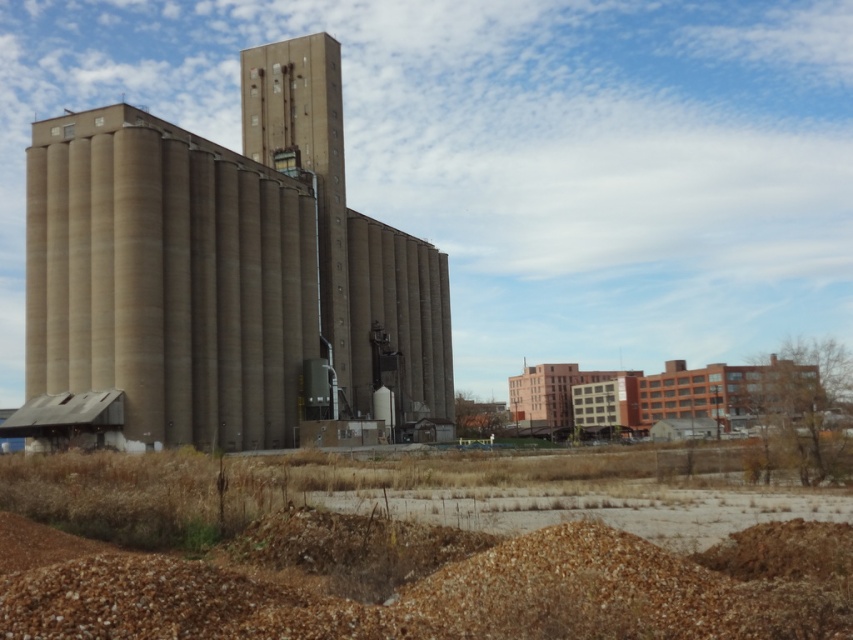
Is brown gravel at lower center to the left of concrete silo at center from the viewer's perspective?

Incorrect, brown gravel at lower center is not on the left side of concrete silo at center.

Between point (257, 563) and point (296, 83), which one is positioned behind?

Point (296, 83)

I want to click on brown gravel at lower center, so click(389, 563).